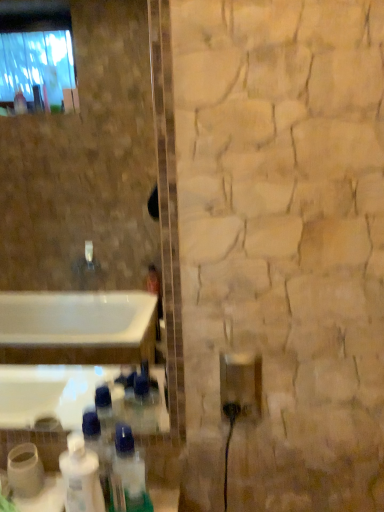
Question: From the image's perspective, relative to clear plastic bottle at lower center, the 2th bottle viewed from the left, is white glossy bottle at lower left above or below?

Choices:
 (A) below
 (B) above

Answer: (A)

Question: Is white glossy bottle at lower left wider or thinner than clear plastic bottle at lower center, the 2th bottle viewed from the left?

Choices:
 (A) thin
 (B) wide

Answer: (A)

Question: Based on their relative distances, which object is farther from the white glossy bottle at lower left, which is counted as the 1th bottle, starting from the left?

Choices:
 (A) white glossy bottle at lower left
 (B) clear plastic bottle at lower center, the 2th bottle viewed from the left

Answer: (B)

Question: Which of these objects is positioned closest to the white glossy bottle at lower left?

Choices:
 (A) white glossy bottle at lower left, which appears as the second bottle when viewed from the right
 (B) clear plastic bottle at lower center, which ranks as the first bottle in right-to-left order

Answer: (A)